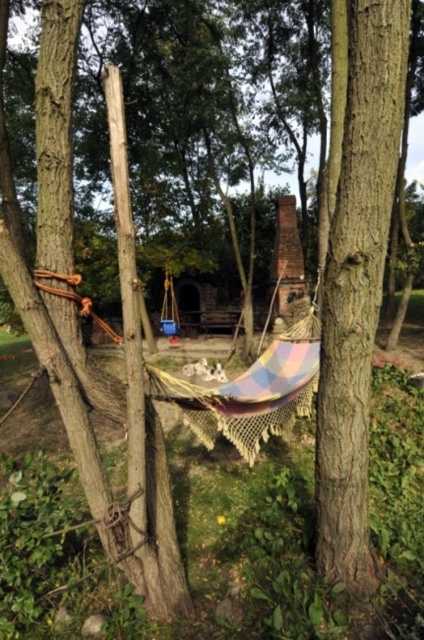
Can you confirm if smooth brown tree trunk at center is smaller than rough wood tree trunk at left?

Correct, smooth brown tree trunk at center occupies less space than rough wood tree trunk at left.

Is smooth brown tree trunk at center closer to camera compared to rough wood tree trunk at left?

That is False.

Image resolution: width=424 pixels, height=640 pixels. Find the location of `smooth brown tree trunk at center`. smooth brown tree trunk at center is located at coordinates (357, 285).

Find the location of a particular element. smooth brown tree trunk at center is located at coordinates (357, 285).